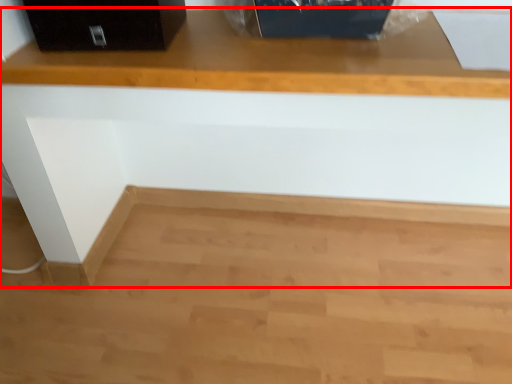
Question: From the image's perspective, where is furniture (annotated by the red box) located relative to file cabinet?

Choices:
 (A) above
 (B) below

Answer: (B)